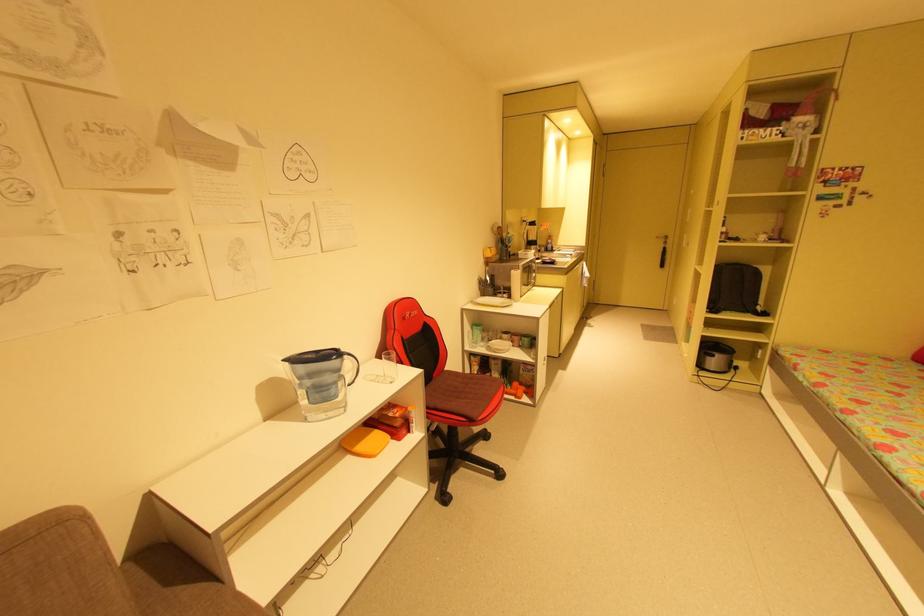
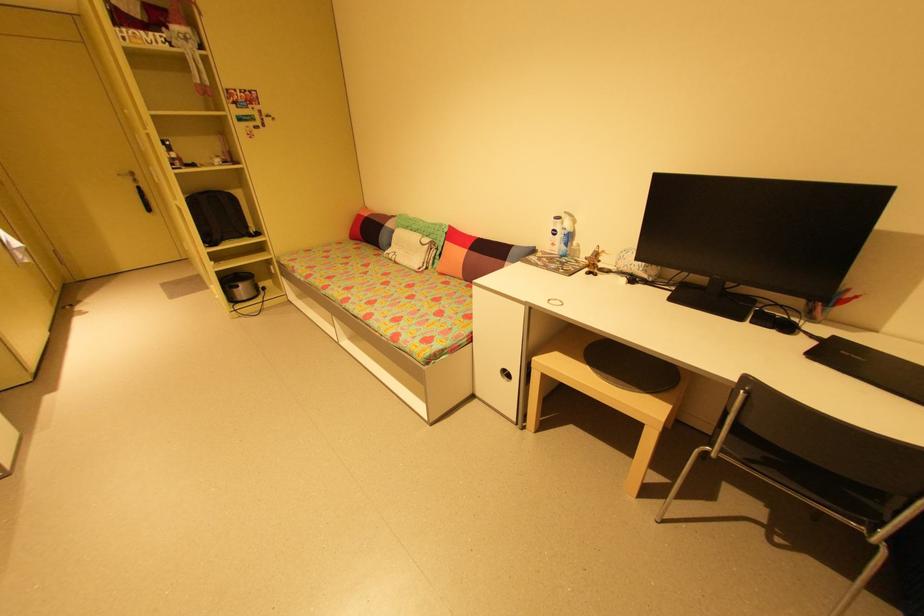
Where in the second image is the point corresponding to point (718, 308) from the first image?

(215, 241)